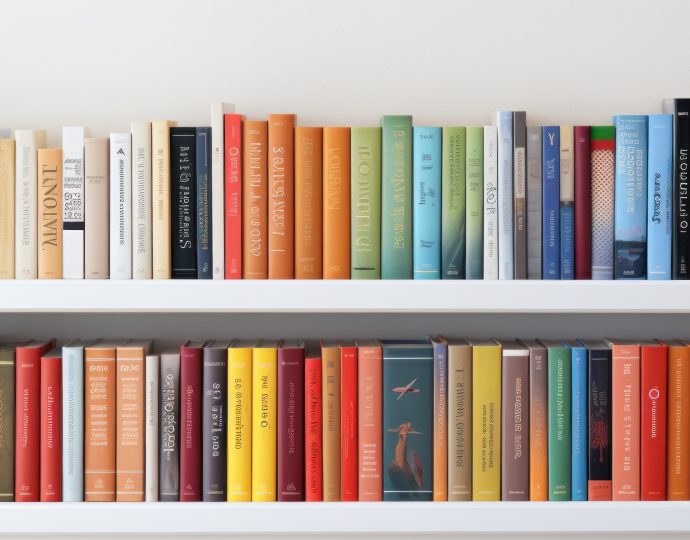
At what (x,y) coordinates should I click in order to perform the action: click on blue books. Please return your answer as a coordinate pair (x, y). Image resolution: width=690 pixels, height=540 pixels. Looking at the image, I should click on (660, 205), (633, 213), (551, 234), (506, 239), (426, 248), (204, 252), (580, 428), (415, 401), (75, 489).